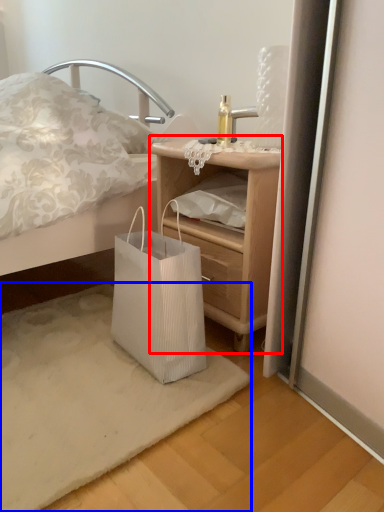
Question: Which object is closer to the camera taking this photo, nightstand (highlighted by a red box) or mat (highlighted by a blue box)?

Choices:
 (A) nightstand
 (B) mat

Answer: (B)